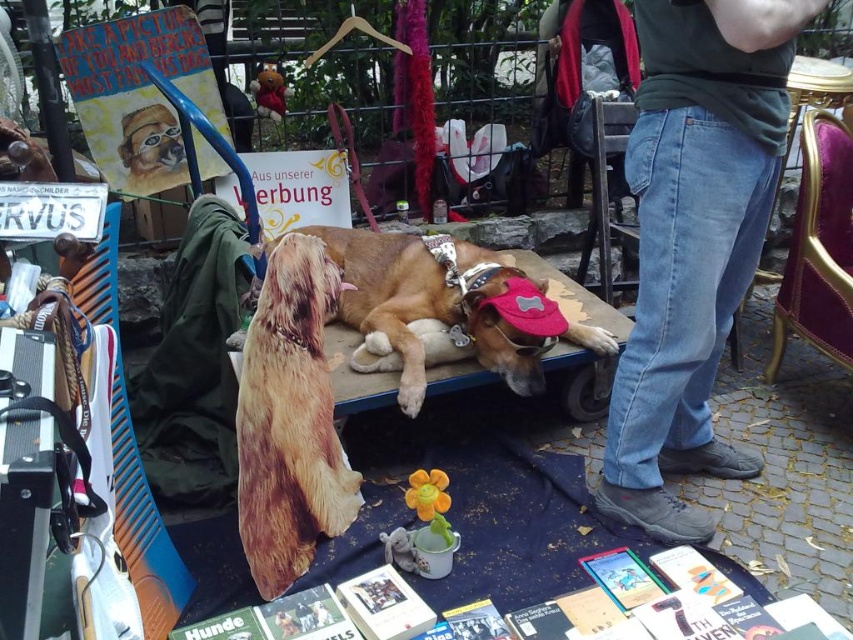
Question: In this image, where is jeans at lower right located relative to brown furry dog at center?

Choices:
 (A) below
 (B) above

Answer: (B)

Question: Observing the image, what is the correct spatial positioning of jeans at lower right in reference to brown fur dog at center?

Choices:
 (A) above
 (B) below

Answer: (A)

Question: Which of the following is the closest to the observer?

Choices:
 (A) (744, 193)
 (B) (328, 488)
 (C) (485, 248)

Answer: (A)

Question: Which object is closer to the camera taking this photo?

Choices:
 (A) brown fur dog at center
 (B) jeans at lower right
 (C) brown furry dog at center

Answer: (B)

Question: Which object is the farthest from the brown fur dog at center?

Choices:
 (A) brown furry dog at center
 (B) jeans at lower right

Answer: (B)

Question: Considering the relative positions of brown furry dog at center and brown fur dog at center in the image provided, where is brown furry dog at center located with respect to brown fur dog at center?

Choices:
 (A) left
 (B) right

Answer: (A)